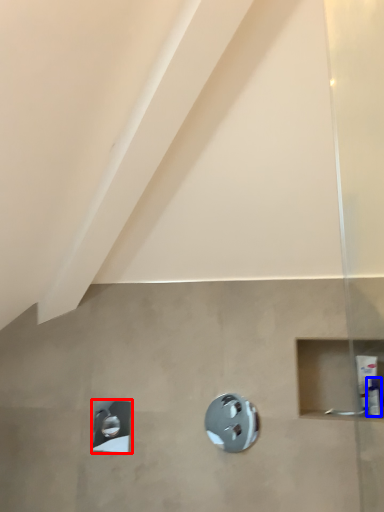
Question: Which point is further to the camera, shower (highlighted by a red box) or toiletry (highlighted by a blue box)?

Choices:
 (A) shower
 (B) toiletry

Answer: (A)